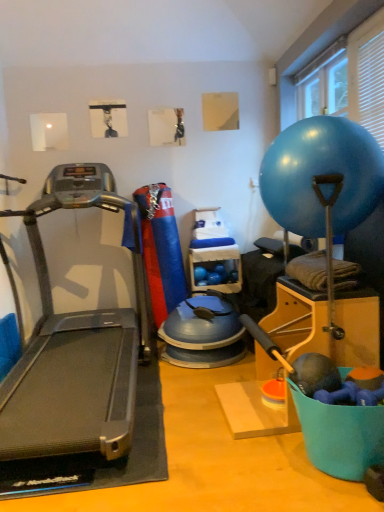
Question: Does clear plastic container at center have a greater height compared to blue rubber ball at upper right?

Choices:
 (A) no
 (B) yes

Answer: (A)

Question: Does clear plastic container at center have a lesser height compared to blue rubber ball at upper right?

Choices:
 (A) yes
 (B) no

Answer: (A)

Question: Can you see clear plastic container at center touching blue rubber ball at upper right?

Choices:
 (A) no
 (B) yes

Answer: (A)

Question: Is clear plastic container at center smaller than blue rubber ball at upper right?

Choices:
 (A) no
 (B) yes

Answer: (B)

Question: Is clear plastic container at center bigger than blue rubber ball at upper right?

Choices:
 (A) no
 (B) yes

Answer: (A)

Question: Is clear plastic container at center in front of or behind transparent plastic window screen at upper right in the image?

Choices:
 (A) front
 (B) behind

Answer: (B)

Question: Would you say clear plastic container at center is to the left or to the right of transparent plastic window screen at upper right in the picture?

Choices:
 (A) right
 (B) left

Answer: (B)

Question: Would you say clear plastic container at center is inside or outside transparent plastic window screen at upper right?

Choices:
 (A) inside
 (B) outside

Answer: (B)

Question: Is point (195, 249) positioned closer to the camera than point (332, 87)?

Choices:
 (A) farther
 (B) closer

Answer: (A)

Question: From the image's perspective, is transparent plastic window screen at upper right positioned above or below blue rubber ball at upper right?

Choices:
 (A) below
 (B) above

Answer: (B)

Question: Is transparent plastic window screen at upper right wider or thinner than blue rubber ball at upper right?

Choices:
 (A) wide
 (B) thin

Answer: (B)

Question: Considering their positions, is transparent plastic window screen at upper right located in front of or behind blue rubber ball at upper right?

Choices:
 (A) front
 (B) behind

Answer: (B)

Question: Is transparent plastic window screen at upper right situated inside blue rubber ball at upper right or outside?

Choices:
 (A) outside
 (B) inside

Answer: (A)

Question: In terms of width, does silver metallic treadmill at left look wider or thinner when compared to blue rubber ball at upper right?

Choices:
 (A) thin
 (B) wide

Answer: (B)

Question: From a real-world perspective, relative to blue rubber ball at upper right, is silver metallic treadmill at left vertically above or below?

Choices:
 (A) above
 (B) below

Answer: (B)